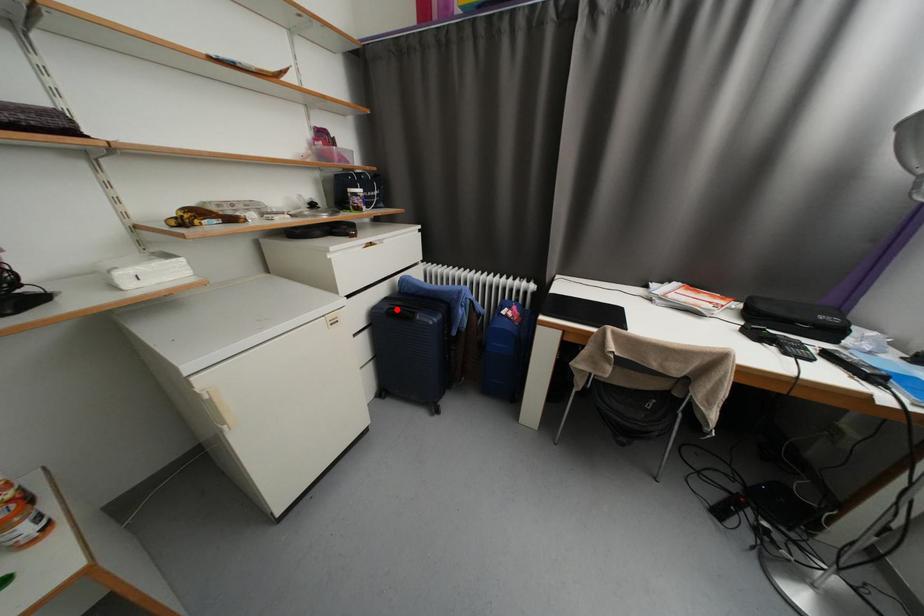
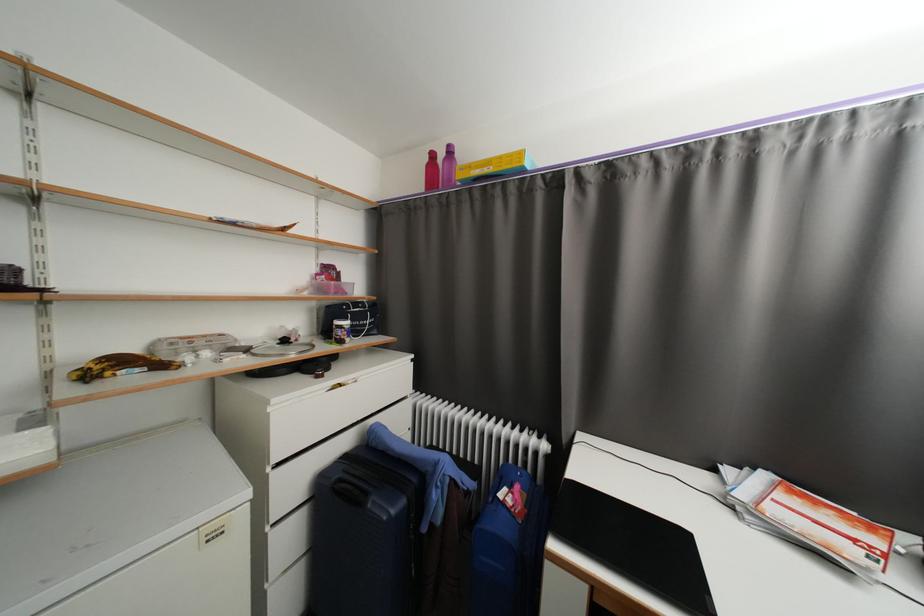
The point at the highlighted location is marked in the first image. Where is the corresponding point in the second image?

(346, 482)